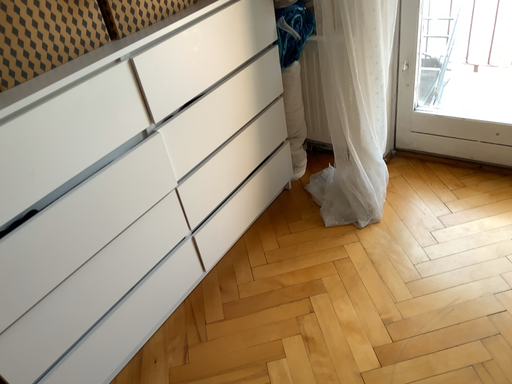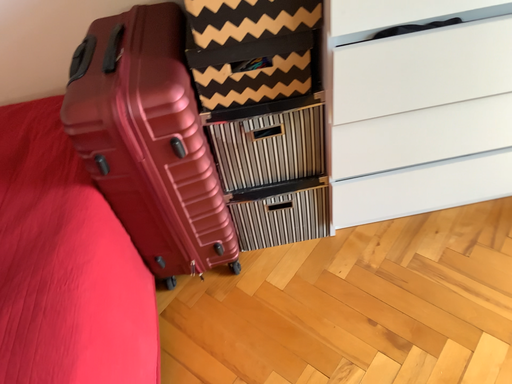
Question: How did the camera likely rotate when shooting the video?

Choices:
 (A) rotated upward
 (B) rotated downward

Answer: (B)